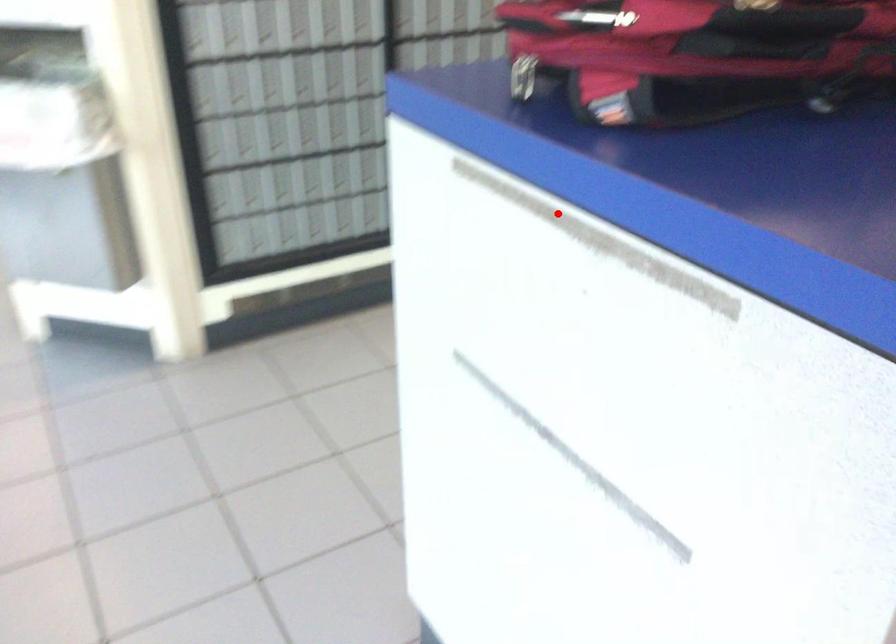
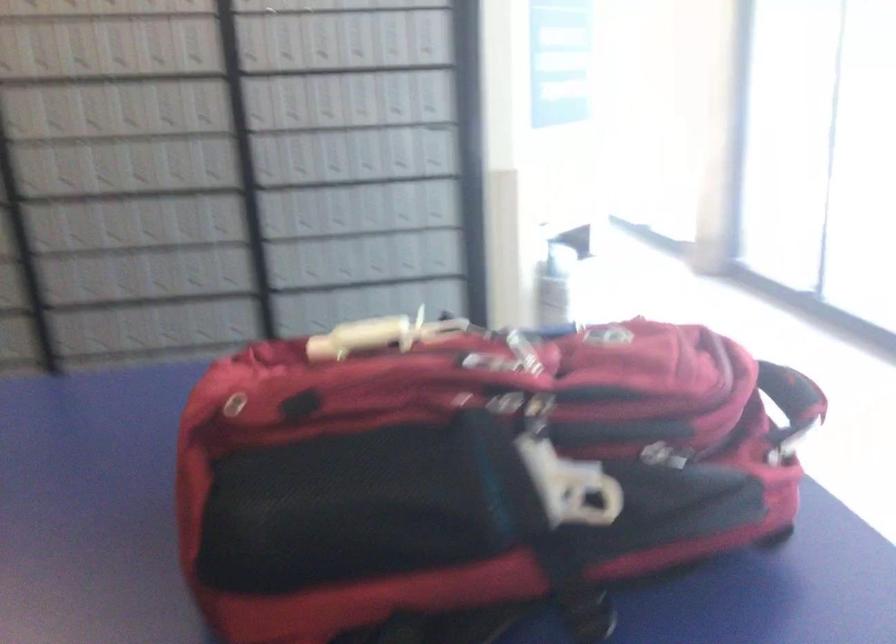
Question: I am providing you with two images of the same scene from different viewpoints. A red point is marked on the first image. At the location where the point appears in image 1, is it still visible in image 2?

Choices:
 (A) Yes
 (B) No

Answer: (B)